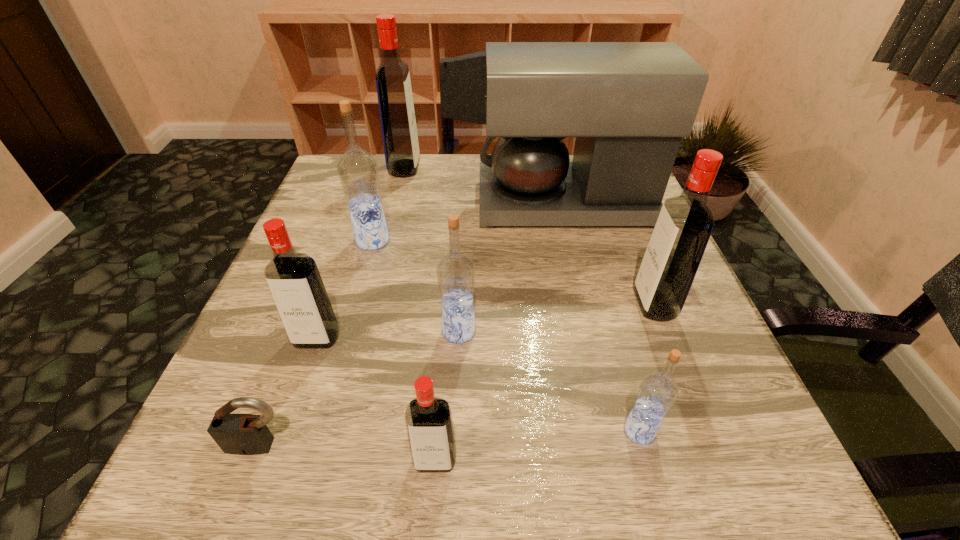
This screenshot has height=540, width=960. Find the location of `coffee maker that is at the right edge`. coffee maker that is at the right edge is located at coordinates (628, 104).

Locate an element on the screen. object at the far left corner is located at coordinates (398, 124).

The height and width of the screenshot is (540, 960). Identify the location of object present at the near left corner. (241, 434).

Locate an element on the screen. object that is at the far right corner is located at coordinates (628, 104).

This screenshot has height=540, width=960. Find the location of `object that is at the near right corner`. object that is at the near right corner is located at coordinates (658, 391).

Locate an element on the screen. vacant region at the near edge of the desktop is located at coordinates (659, 483).

The height and width of the screenshot is (540, 960). I want to click on free location at the left edge of the desktop, so click(223, 396).

The height and width of the screenshot is (540, 960). Find the location of `vacant area at the right edge of the desktop`. vacant area at the right edge of the desktop is located at coordinates (616, 318).

Find the location of `vacant space at the near left corner`. vacant space at the near left corner is located at coordinates (290, 448).

I want to click on free location at the near right corner of the desktop, so click(x=679, y=486).